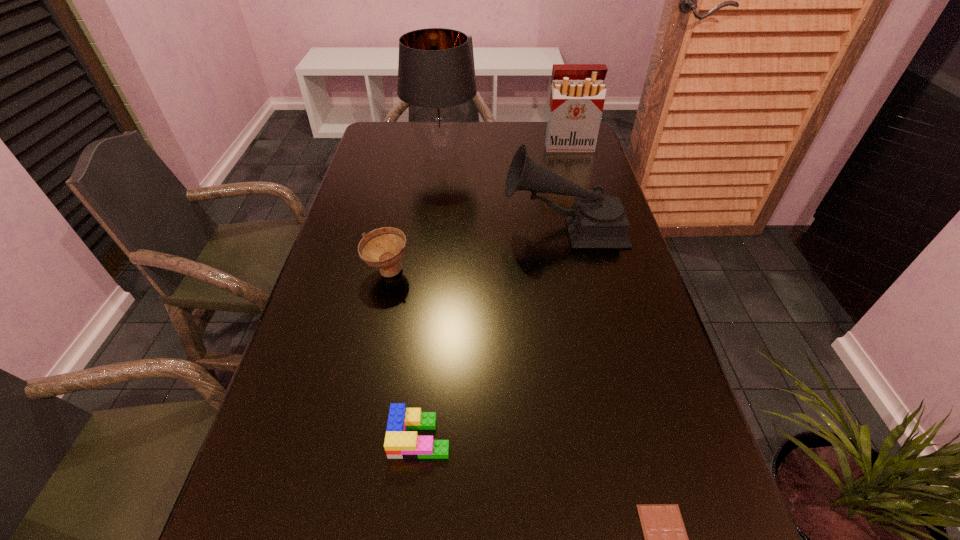
Where is `the fifth closest object to the fifth farthest object`? The height and width of the screenshot is (540, 960). the fifth closest object to the fifth farthest object is located at coordinates pos(577,97).

Locate which object ranks third in proximity to the fourth farthest object. Please provide its 2D coordinates. Your answer should be formatted as a tuple, i.e. [(x, y)], where the tuple contains the x and y coordinates of a point satisfying the conditions above.

[(435, 73)]

Locate an element on the screen. vacant area that satisfies the following two spatial constraints: 1. on the back side of the tallest object; 2. on the left side of the fourth farthest object is located at coordinates (413, 154).

The width and height of the screenshot is (960, 540). What are the coordinates of `blank area in the image that satisfies the following two spatial constraints: 1. from the horn of the phonograph_record; 2. on the front side of the soup bowl` in the screenshot? It's located at (573, 272).